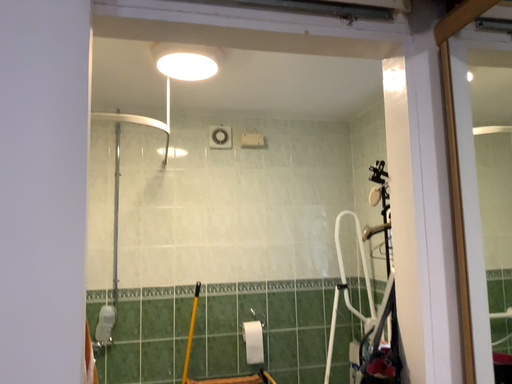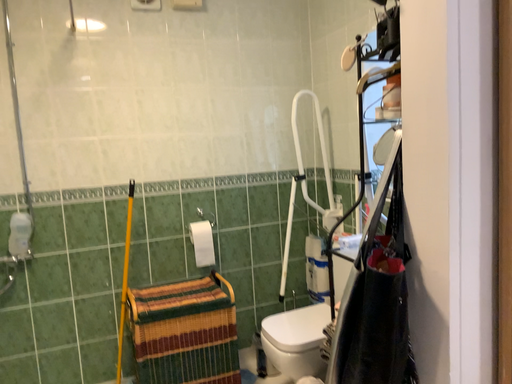
Question: Which way did the camera rotate in the video?

Choices:
 (A) rotated downward
 (B) rotated upward

Answer: (A)